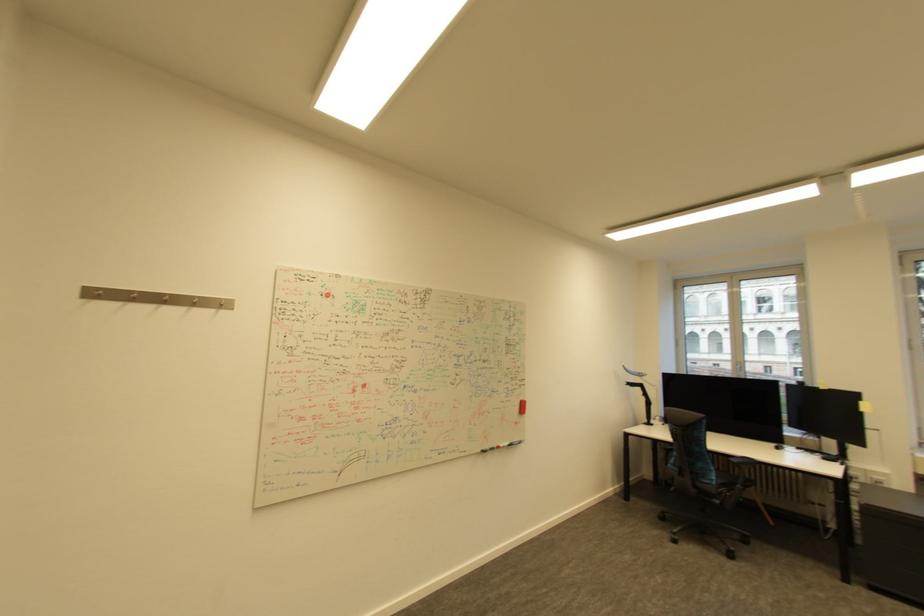
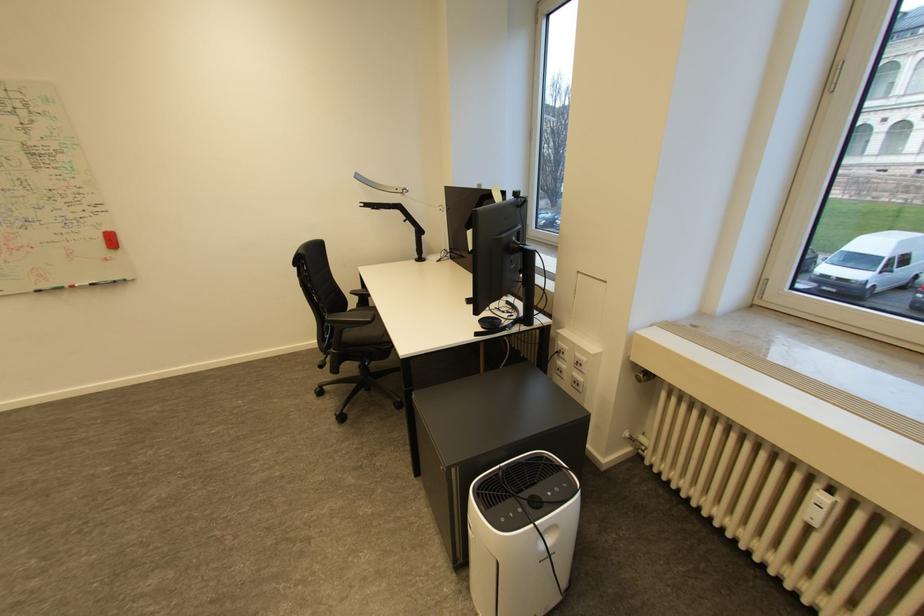
In the second image, find the point that corresponds to [491,448] in the first image.

(47, 288)